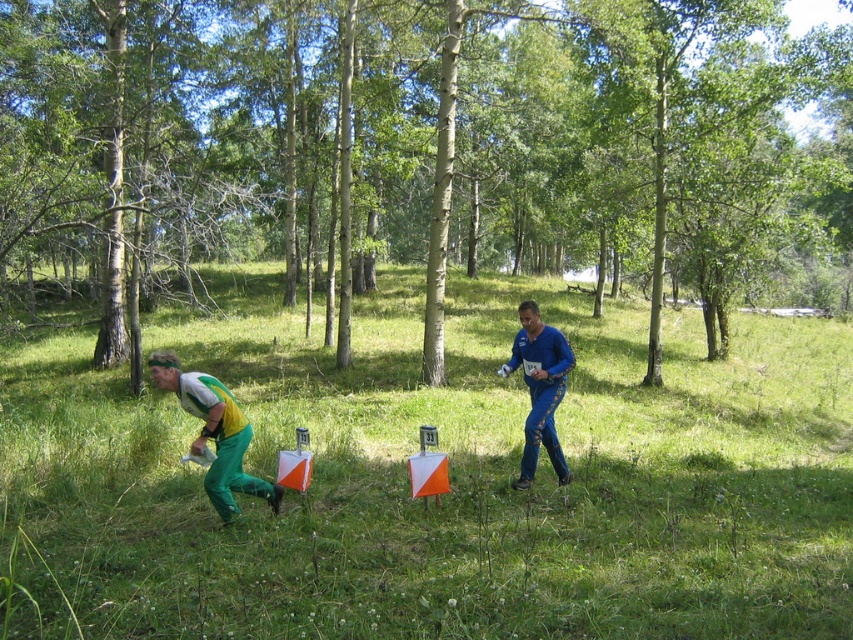
Which of these two, brown bark tree at center or green grass at lower left, stands taller?

brown bark tree at center is taller.

Can you confirm if brown bark tree at center is thinner than green grass at lower left?

No.

At what (x,y) coordinates should I click in order to perform the action: click on brown bark tree at center. Please return your answer as a coordinate pair (x, y). This screenshot has width=853, height=640. Looking at the image, I should click on (415, 150).

Between point (590, 536) and point (561, 390), which one is positioned behind?

Positioned behind is point (561, 390).

Does green grass at lower left have a larger size compared to blue textured pants at center?

Yes.

This screenshot has width=853, height=640. Identify the location of green grass at lower left. (450, 481).

Is the position of green fabric pants at lower left less distant than that of blue textured pants at center?

That is True.

Does green fabric pants at lower left appear on the left side of blue textured pants at center?

Yes, green fabric pants at lower left is to the left of blue textured pants at center.

The width and height of the screenshot is (853, 640). I want to click on green fabric pants at lower left, so click(x=213, y=433).